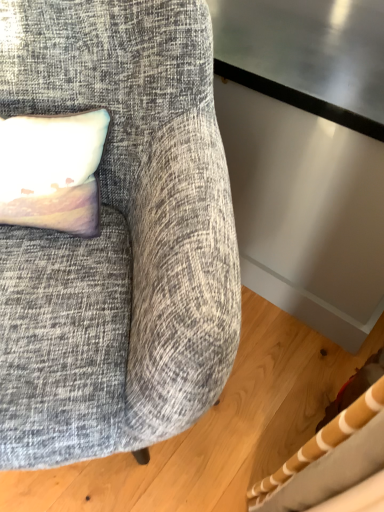
Question: From their relative heights in the image, would you say pastel fabric pillow at upper left is taller or shorter than textured gray fabric chair at upper left?

Choices:
 (A) short
 (B) tall

Answer: (A)

Question: Considering the positions of point (72, 140) and point (226, 174), is point (72, 140) closer or farther from the camera than point (226, 174)?

Choices:
 (A) farther
 (B) closer

Answer: (A)

Question: In the image, is pastel fabric pillow at upper left positioned in front of or behind textured gray fabric chair at upper left?

Choices:
 (A) front
 (B) behind

Answer: (B)

Question: Considering the positions of textured gray fabric chair at upper left and pastel fabric pillow at upper left in the image, is textured gray fabric chair at upper left bigger or smaller than pastel fabric pillow at upper left?

Choices:
 (A) small
 (B) big

Answer: (B)

Question: Do you think textured gray fabric chair at upper left is within pastel fabric pillow at upper left, or outside of it?

Choices:
 (A) inside
 (B) outside

Answer: (B)

Question: In terms of width, does textured gray fabric chair at upper left look wider or thinner when compared to pastel fabric pillow at upper left?

Choices:
 (A) wide
 (B) thin

Answer: (A)

Question: From a real-world perspective, is textured gray fabric chair at upper left physically located above or below pastel fabric pillow at upper left?

Choices:
 (A) below
 (B) above

Answer: (A)